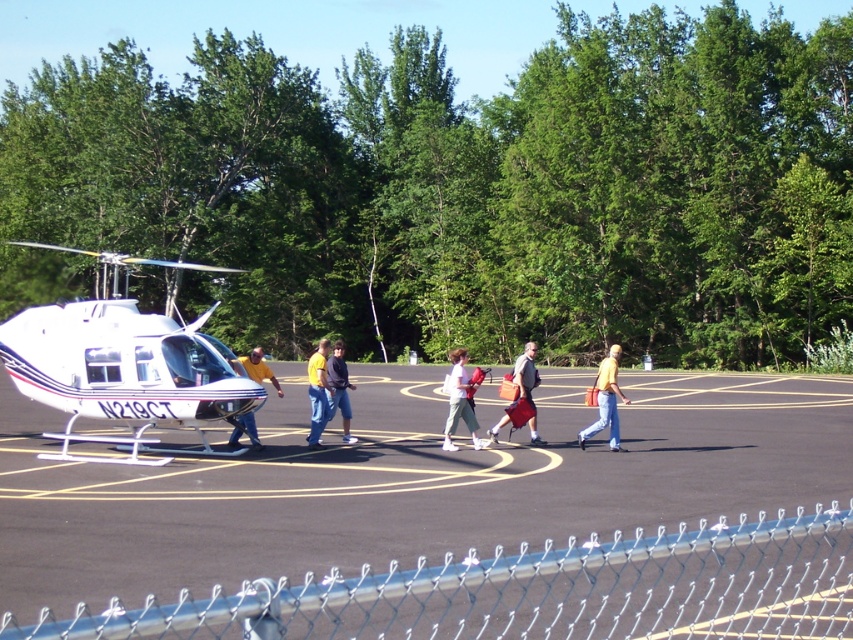
Question: Which of the following is the closest to the observer?

Choices:
 (A) white glossy helicopter at left
 (B) white cotton shirt at center
 (C) metal chain-link fence at lower center

Answer: (C)

Question: Can you confirm if yellow fabric shirt at center is positioned above yellow shirt at center?

Choices:
 (A) yes
 (B) no

Answer: (B)

Question: Which of the following is the closest to the observer?

Choices:
 (A) (360, 602)
 (B) (525, 380)
 (C) (270, 372)
 (D) (312, 436)

Answer: (A)

Question: Which object appears closest to the camera in this image?

Choices:
 (A) yellow fabric shirt at center
 (B) metal chain-link fence at lower center
 (C) gray fabric backpack at center

Answer: (B)

Question: Is white glossy helicopter at left bigger than yellow fabric shirt at center?

Choices:
 (A) yes
 (B) no

Answer: (A)

Question: Is white glossy helicopter at left positioned at the back of white cotton shirt at center?

Choices:
 (A) no
 (B) yes

Answer: (A)